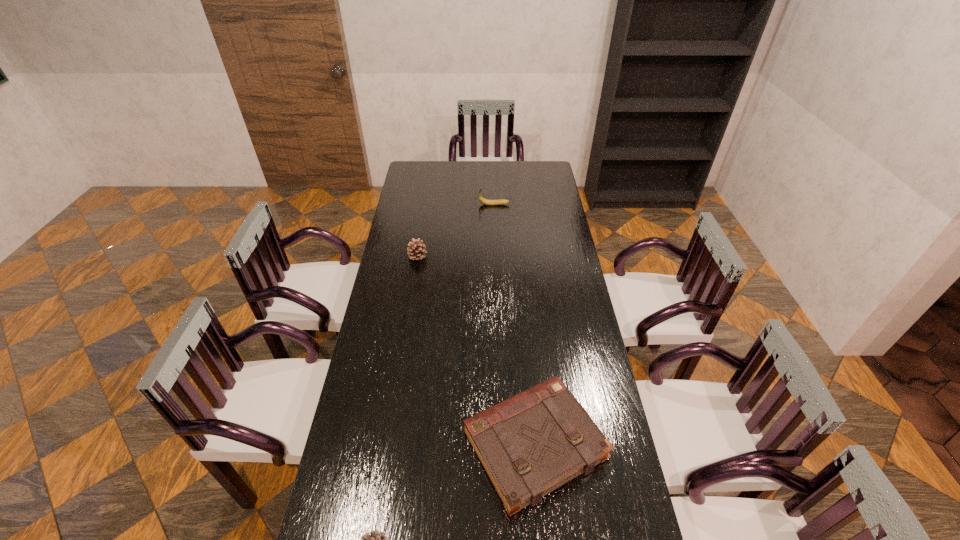
Locate an element on the screen. banana is located at coordinates (484, 201).

The height and width of the screenshot is (540, 960). What are the coordinates of `the second farthest object` in the screenshot? It's located at (416, 251).

The height and width of the screenshot is (540, 960). I want to click on hardback book, so click(x=530, y=444).

Where is `free location located at the stem of the farthest object`? This screenshot has width=960, height=540. free location located at the stem of the farthest object is located at coordinates (465, 205).

Identify the location of free space located 0.360m at the stem of the farthest object. (409, 205).

Find the location of a particular element. Image resolution: width=960 pixels, height=540 pixels. vacant space situated 0.220m at the stem of the farthest object is located at coordinates (436, 205).

You are a GUI agent. You are given a task and a screenshot of the screen. Output one action in this format:
    pyautogui.click(x=<x>, y=<y>)
    Task: Click on the free space located on the front of the farther pinecone
    The image size is (960, 540).
    Given the screenshot: What is the action you would take?
    pyautogui.click(x=413, y=288)

Locate an element on the screen. free space located on the left of the second nearest object is located at coordinates (399, 445).

Where is `object present at the left edge`? object present at the left edge is located at coordinates (416, 251).

In order to click on object that is at the right edge in this screenshot , I will do `click(530, 444)`.